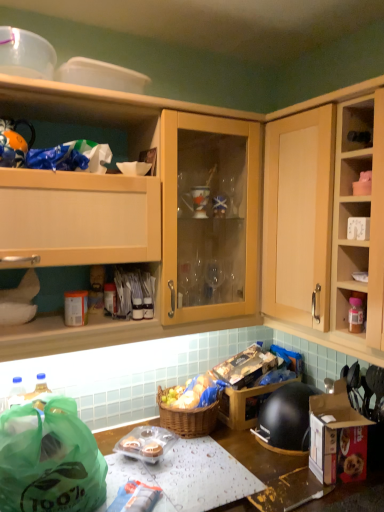
At what (x,y) coordinates should I click in order to perform the action: click on matte plastic container at upper right. Please return your answer as a coordinate pair (x, y). Looking at the image, I should click on (356, 123).

Measure the distance between matte plastic container at upper right and camera.

The distance of matte plastic container at upper right from camera is 4.04 feet.

Locate an element on the screen. Image resolution: width=384 pixels, height=512 pixels. brown woven basket at lower center is located at coordinates (194, 393).

What is the approximate width of green plastic bag at lower left?

The width of green plastic bag at lower left is 12.24 inches.

The image size is (384, 512). What do you see at coordinates (326, 224) in the screenshot?
I see `wooden cabinet at right, arranged as the 2th cabinetry when viewed from the left` at bounding box center [326, 224].

Where is `matte wood cabinet at upper left, the 2th cabinetry when ordered from right to left`? matte wood cabinet at upper left, the 2th cabinetry when ordered from right to left is located at coordinates (136, 105).

Is matte wood cabinet at upper left, acting as the first cabinetry starting from the left, oriented away from wooden cabinet at right, the first cabinetry in the right-to-left sequence?

No, matte wood cabinet at upper left, acting as the first cabinetry starting from the left, is not facing the opposite direction of wooden cabinet at right, the first cabinetry in the right-to-left sequence.

Image resolution: width=384 pixels, height=512 pixels. I want to click on cabinetry that appears above the wooden cabinet at right, the first cabinetry in the right-to-left sequence (from the image's perspective), so click(x=136, y=105).

Which point is more forward, (102,252) or (296,268)?

The point (102,252) is closer.

In the scene shown: Is matte wood cabinet at upper left, acting as the first cabinetry starting from the left, next to wooden cabinet at right, the first cabinetry in the right-to-left sequence?

There is a gap between matte wood cabinet at upper left, acting as the first cabinetry starting from the left, and wooden cabinet at right, the first cabinetry in the right-to-left sequence.

Looking at their sizes, would you say matte wood cabinet at upper left, the 2th cabinetry when ordered from right to left, is wider or thinner than woven brown picnic basket at lower center?

In the image, matte wood cabinet at upper left, the 2th cabinetry when ordered from right to left, appears to be wider than woven brown picnic basket at lower center.

Is matte wood cabinet at upper left, the 2th cabinetry when ordered from right to left, facing away from woven brown picnic basket at lower center?

No, matte wood cabinet at upper left, the 2th cabinetry when ordered from right to left, is not facing away from woven brown picnic basket at lower center.

Which of these two, matte wood cabinet at upper left, acting as the first cabinetry starting from the left, or woven brown picnic basket at lower center, is smaller?

Smaller between the two is woven brown picnic basket at lower center.

Is matte wood cabinet at upper left, acting as the first cabinetry starting from the left, next to woven brown picnic basket at lower center?

matte wood cabinet at upper left, acting as the first cabinetry starting from the left, and woven brown picnic basket at lower center are not in contact.

Where is `picnic basket below the wooden cabinet at right, arranged as the 2th cabinetry when viewed from the left (from a real-world perspective)`? The image size is (384, 512). picnic basket below the wooden cabinet at right, arranged as the 2th cabinetry when viewed from the left (from a real-world perspective) is located at coordinates (187, 418).

Between wooden cabinet at right, the first cabinetry in the right-to-left sequence, and woven brown picnic basket at lower center, which one appears on the left side from the viewer's perspective?

woven brown picnic basket at lower center is more to the left.

From a real-world perspective, between wooden cabinet at right, the first cabinetry in the right-to-left sequence, and woven brown picnic basket at lower center, who is vertically higher?

From a 3D spatial view, wooden cabinet at right, the first cabinetry in the right-to-left sequence, is above.

Which of these two, wooden cabinet at right, the first cabinetry in the right-to-left sequence, or woven brown picnic basket at lower center, stands shorter?

woven brown picnic basket at lower center is shorter.

The height and width of the screenshot is (512, 384). Identify the location of stuff that appears behind the wooden cabinet at right, arranged as the 2th cabinetry when viewed from the left. [x=194, y=393].

How far apart are wooden cabinet at right, arranged as the 2th cabinetry when viewed from the left, and brown woven basket at lower center?

wooden cabinet at right, arranged as the 2th cabinetry when viewed from the left, is 28.05 inches from brown woven basket at lower center.

Is point (267, 249) positioned behind point (185, 404)?

No, it is in front of (185, 404).

Which object is further away from the camera taking this photo, wooden cabinet at right, the first cabinetry in the right-to-left sequence, or brown woven basket at lower center?

brown woven basket at lower center is more distant.

Can you confirm if cardboard box with dog food at lower right is smaller than matte plastic container at upper right?

No.

From the picture: Between cardboard box with dog food at lower right and matte plastic container at upper right, which one is positioned in front?

matte plastic container at upper right.

Is cardboard box with dog food at lower right not near matte plastic container at upper right?

No.

Where is `cabinet that is above the cardboard box with dog food at lower right (from the image's perspective)`? cabinet that is above the cardboard box with dog food at lower right (from the image's perspective) is located at coordinates (356, 123).

Consider the image. Considering the positions of objects wooden cabinet at right, the first cabinetry in the right-to-left sequence, and green plastic bag at lower left in the image provided, who is more to the left, wooden cabinet at right, the first cabinetry in the right-to-left sequence, or green plastic bag at lower left?

Positioned to the left is green plastic bag at lower left.

Does point (320, 245) lie in front of point (58, 430)?

No, it is not.

Does wooden cabinet at right, arranged as the 2th cabinetry when viewed from the left, touch green plastic bag at lower left?

There is a gap between wooden cabinet at right, arranged as the 2th cabinetry when viewed from the left, and green plastic bag at lower left.

Is green plastic bag at lower left located within wooden cabinet at right, arranged as the 2th cabinetry when viewed from the left?

No, green plastic bag at lower left is not a part of wooden cabinet at right, arranged as the 2th cabinetry when viewed from the left.

Considering the relative sizes of wooden table at lower center and cardboard box with dog food at lower right in the image provided, is wooden table at lower center taller than cardboard box with dog food at lower right?

Correct, wooden table at lower center is much taller as cardboard box with dog food at lower right.

Does wooden table at lower center appear on the left side of cardboard box with dog food at lower right?

Yes, wooden table at lower center is to the left of cardboard box with dog food at lower right.

Is wooden table at lower center closer to camera compared to cardboard box with dog food at lower right?

Yes, it is.

Between point (294, 467) and point (347, 454), which one is positioned in front?

Point (347, 454)

Identify the location of cabinetry above the wooden cabinet at right, arranged as the 2th cabinetry when viewed from the left (from the image's perspective). Image resolution: width=384 pixels, height=512 pixels. (136, 105).

This screenshot has height=512, width=384. I want to click on picnic basket behind the matte wood cabinet at upper left, the 2th cabinetry when ordered from right to left, so click(187, 418).

Which object lies nearer to the anchor point cardboard box with dog food at lower right, wooden cabinet at right, the first cabinetry in the right-to-left sequence, or wooden table at lower center?

wooden table at lower center is closer to cardboard box with dog food at lower right.

When comparing their distances from wooden cabinet at right, the first cabinetry in the right-to-left sequence, does brown woven basket at lower center or matte plastic container at upper right seem closer?

matte plastic container at upper right is positioned closer to the anchor wooden cabinet at right, the first cabinetry in the right-to-left sequence.

Estimate the real-world distances between objects in this image. Which object is further from wooden table at lower center, brown woven basket at lower center or matte wood cabinet at upper left, acting as the first cabinetry starting from the left?

Among the two, matte wood cabinet at upper left, acting as the first cabinetry starting from the left, is located further to wooden table at lower center.

Estimate the real-world distances between objects in this image. Which object is closer to woven brown picnic basket at lower center, wooden cabinet at right, arranged as the 2th cabinetry when viewed from the left, or wooden table at lower center?

wooden table at lower center.

From the image, which object appears to be nearer to wooden cabinet at right, arranged as the 2th cabinetry when viewed from the left, cardboard box with dog food at lower right or green plastic bag at lower left?

The object closer to wooden cabinet at right, arranged as the 2th cabinetry when viewed from the left, is cardboard box with dog food at lower right.

From the image, which object appears to be farther from green plastic bag at lower left, brown woven basket at lower center or woven brown picnic basket at lower center?

brown woven basket at lower center.

Consider the image. When comparing their distances from matte plastic container at upper right, does wooden cabinet at right, the first cabinetry in the right-to-left sequence, or wooden table at lower center seem further?

wooden table at lower center is positioned further to the anchor matte plastic container at upper right.

From the picture: Estimate the real-world distances between objects in this image. Which object is closer to brown woven basket at lower center, matte plastic container at upper right or matte wood cabinet at upper left, the 2th cabinetry when ordered from right to left?

matte wood cabinet at upper left, the 2th cabinetry when ordered from right to left, lies closer to brown woven basket at lower center than the other object.

At what (x,y) coordinates should I click in order to perform the action: click on stuff between woven brown picnic basket at lower center and cardboard box with dog food at lower right in the horizontal direction. Please return your answer as a coordinate pair (x, y). The width and height of the screenshot is (384, 512). Looking at the image, I should click on (194, 393).

Locate an element on the screen. This screenshot has height=512, width=384. stuff between green plastic bag at lower left and wooden cabinet at right, arranged as the 2th cabinetry when viewed from the left, in the horizontal direction is located at coordinates (194, 393).

Image resolution: width=384 pixels, height=512 pixels. I want to click on picnic basket between wooden cabinet at right, arranged as the 2th cabinetry when viewed from the left, and wooden table at lower center, in the vertical direction, so click(187, 418).

You are a GUI agent. You are given a task and a screenshot of the screen. Output one action in this format:
    pyautogui.click(x=<x>, y=<y>)
    Task: Click on the picnic basket that lies between matte plastic container at upper right and wooden table at lower center from top to bottom
    The image size is (384, 512).
    Given the screenshot: What is the action you would take?
    pyautogui.click(x=187, y=418)